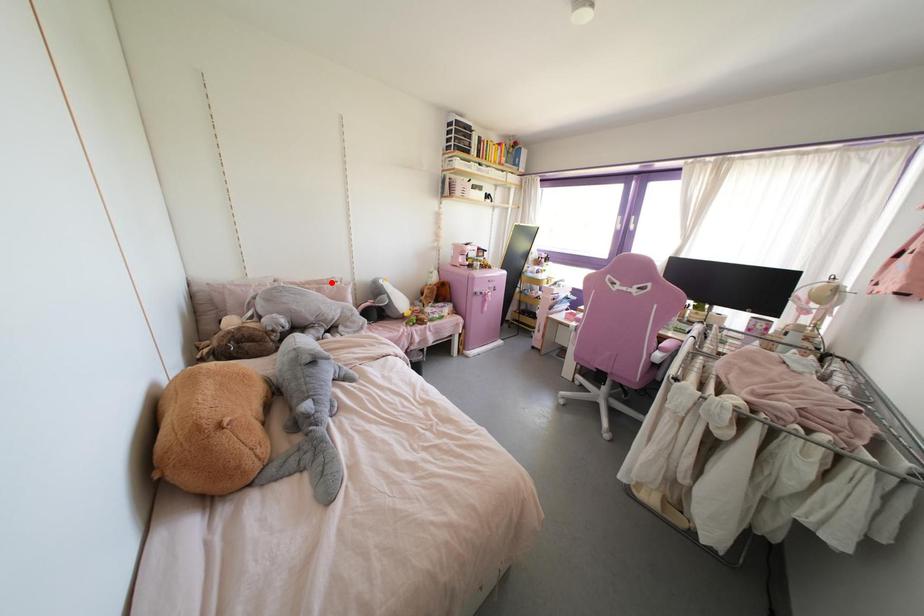
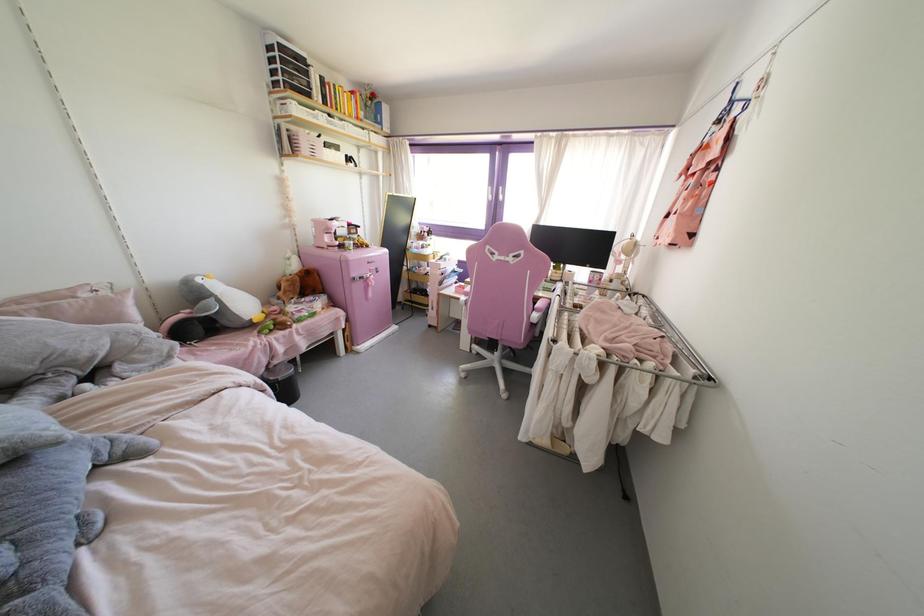
In the second image, find the point that corresponds to the highlighted location in the first image.

(83, 294)